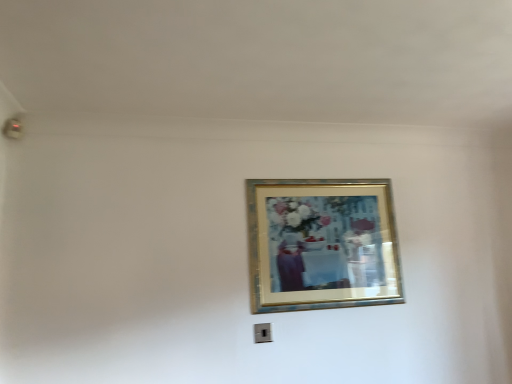
Question: Do you think black plastic electric outlet at lower center is within gold metallic picture frame at upper center, or outside of it?

Choices:
 (A) outside
 (B) inside

Answer: (A)

Question: Is black plastic electric outlet at lower center wider or thinner than gold metallic picture frame at upper center?

Choices:
 (A) thin
 (B) wide

Answer: (A)

Question: Relative to gold metallic picture frame at upper center, is black plastic electric outlet at lower center in front or behind?

Choices:
 (A) front
 (B) behind

Answer: (B)

Question: From a real-world perspective, is gold metallic picture frame at upper center positioned above or below black plastic electric outlet at lower center?

Choices:
 (A) below
 (B) above

Answer: (B)

Question: In the image, is gold metallic picture frame at upper center on the left side or the right side of black plastic electric outlet at lower center?

Choices:
 (A) right
 (B) left

Answer: (A)

Question: In terms of height, does gold metallic picture frame at upper center look taller or shorter compared to black plastic electric outlet at lower center?

Choices:
 (A) short
 (B) tall

Answer: (B)

Question: In the image, is gold metallic picture frame at upper center positioned in front of or behind black plastic electric outlet at lower center?

Choices:
 (A) behind
 (B) front

Answer: (B)